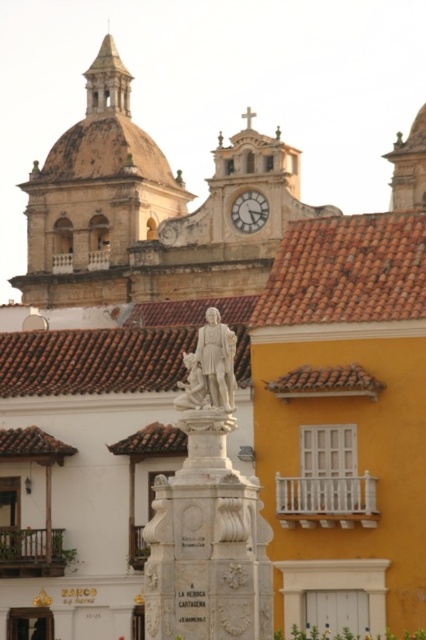
Question: Is white marble statue at center to the left of white marble clock at upper center from the viewer's perspective?

Choices:
 (A) no
 (B) yes

Answer: (B)

Question: Is brown stone dome at upper center smaller than white marble statue at center?

Choices:
 (A) no
 (B) yes

Answer: (A)

Question: Does white marble statue at center lie behind white marble clock at upper center?

Choices:
 (A) no
 (B) yes

Answer: (A)

Question: Estimate the real-world distances between objects in this image. Which object is closer to the brown stone dome at upper center?

Choices:
 (A) white marble clock at upper center
 (B) white marble statue at center

Answer: (A)

Question: Among these points, which one is farthest from the camera?

Choices:
 (A) (239, 205)
 (B) (184, 358)
 (C) (71, 300)

Answer: (C)

Question: Which of the following is the farthest from the observer?

Choices:
 (A) white marble statue at center
 (B) white marble clock at upper center

Answer: (B)